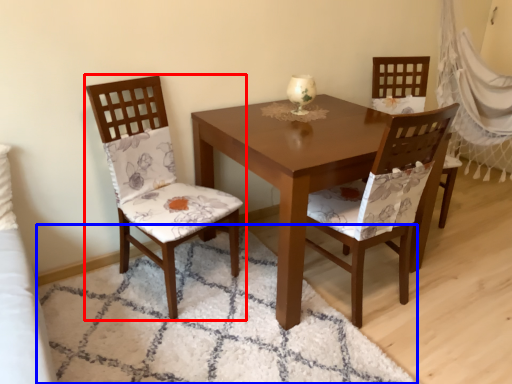
Question: Which point is closer to the camera, chair (highlighted by a red box) or mat (highlighted by a blue box)?

Choices:
 (A) chair
 (B) mat

Answer: (B)